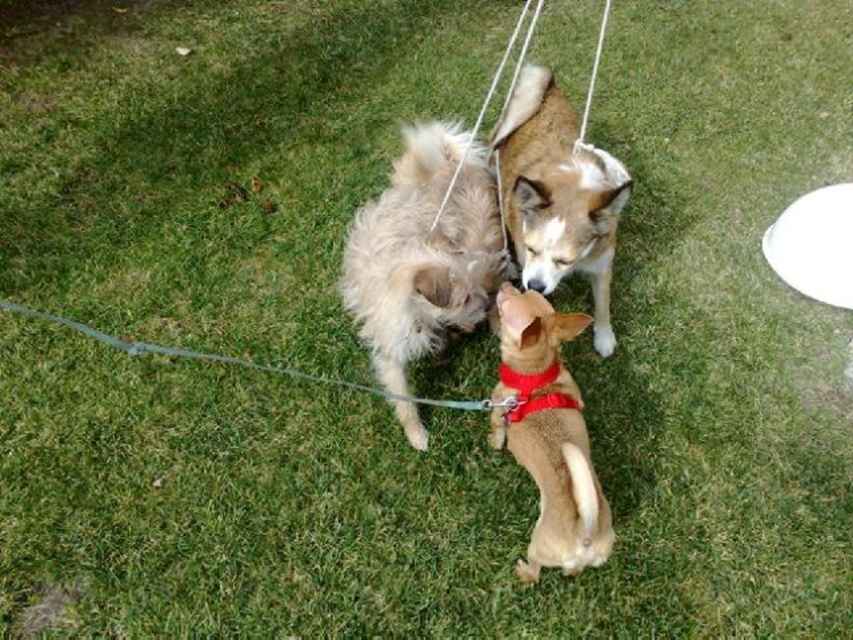
Question: Can you confirm if metallic silver leash at center is smaller than red fabric neckband at center?

Choices:
 (A) yes
 (B) no

Answer: (B)

Question: Which of the following is the farthest from the observer?

Choices:
 (A) metallic silver leash at center
 (B) red fabric neckband at center
 (C) brown soft fur dog at center
 (D) brown fur dog at center

Answer: (A)

Question: In this image, where is red fabric neckband at center located relative to white string at upper center?

Choices:
 (A) left
 (B) right

Answer: (A)

Question: Is brown soft fur dog at center positioned in front of red fabric neckband at center?

Choices:
 (A) no
 (B) yes

Answer: (B)

Question: Estimate the real-world distances between objects in this image. Which object is closer to the white string at upper center?

Choices:
 (A) brown soft fur dog at center
 (B) fuzzy beige dog at center
 (C) metallic silver leash at center
 (D) brown fur dog at center

Answer: (B)

Question: Considering the real-world distances, which object is farthest from the red fabric neckband at center?

Choices:
 (A) metallic silver leash at center
 (B) fuzzy beige dog at center

Answer: (B)